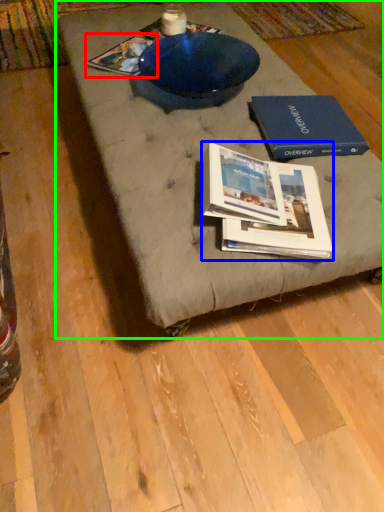
Question: Considering the real-world distances, which object is closest to book (highlighted by a red box)? book (highlighted by a blue box) or coffee table (highlighted by a green box).

Choices:
 (A) book
 (B) coffee table

Answer: (B)